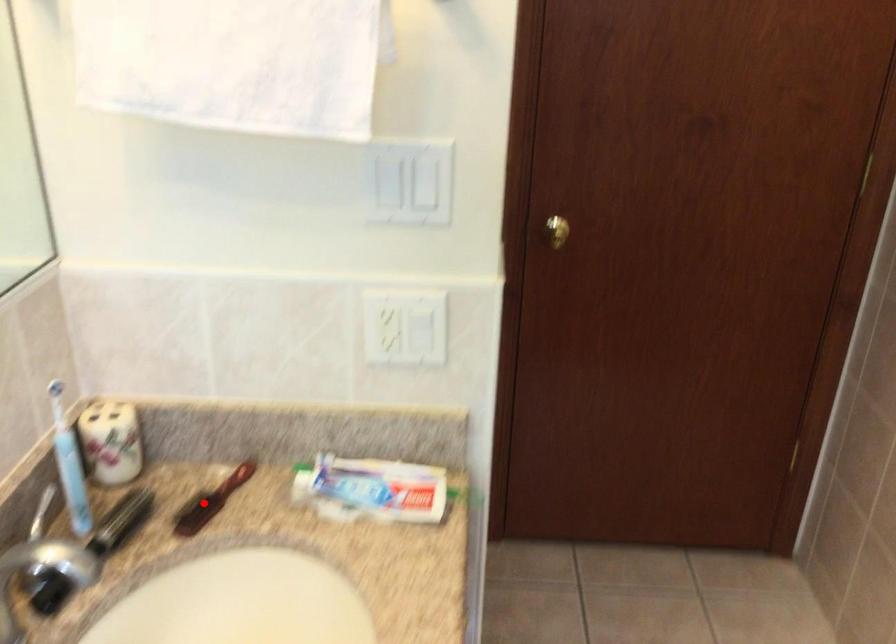
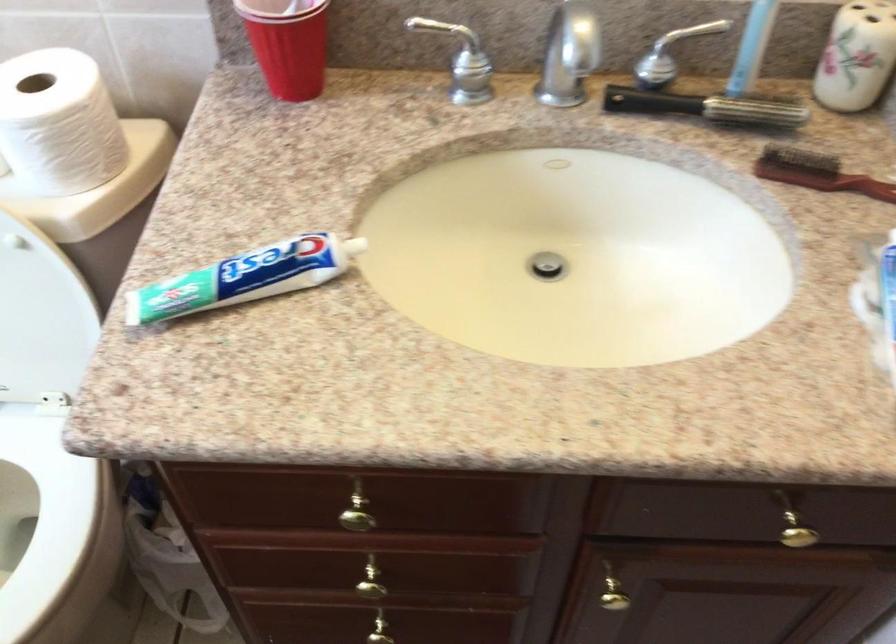
Where in the second image is the point corresponding to the highlighted location from the first image?

(816, 173)